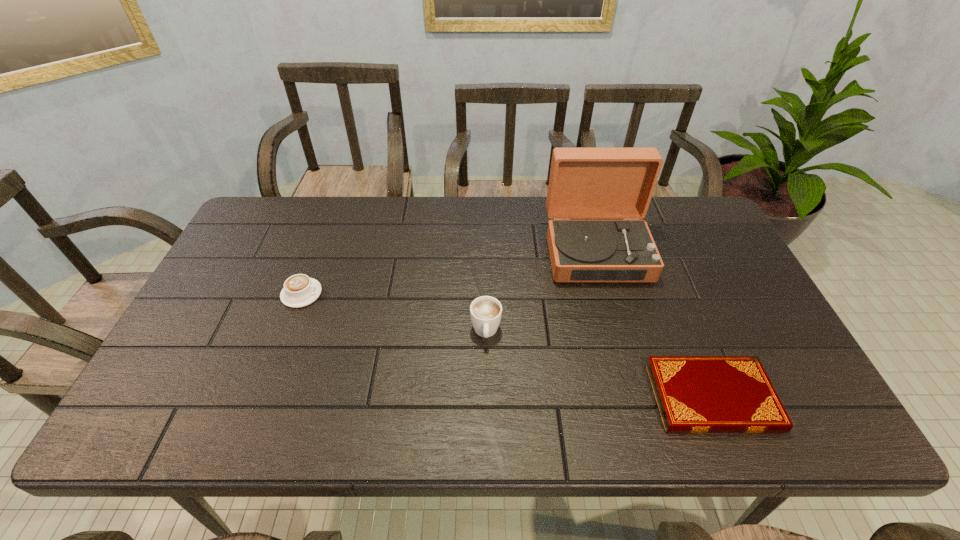
Where is `free location located 0.240m on the cover of the nearest object`? The width and height of the screenshot is (960, 540). free location located 0.240m on the cover of the nearest object is located at coordinates (549, 397).

Locate an element on the screen. This screenshot has width=960, height=540. free point located on the cover of the nearest object is located at coordinates (532, 397).

Where is `vacant space situated on the cover of the nearest object`? This screenshot has height=540, width=960. vacant space situated on the cover of the nearest object is located at coordinates (549, 397).

Where is `object that is at the far edge`? The width and height of the screenshot is (960, 540). object that is at the far edge is located at coordinates (585, 183).

At what (x,y) coordinates should I click in order to perform the action: click on object positioned at the near edge. Please return your answer as a coordinate pair (x, y). Looking at the image, I should click on (695, 394).

You are a GUI agent. You are given a task and a screenshot of the screen. Output one action in this format:
    pyautogui.click(x=<x>, y=<y>)
    Task: Click on the object that is positioned at the right edge
    The height and width of the screenshot is (540, 960).
    Given the screenshot: What is the action you would take?
    pyautogui.click(x=695, y=394)

Locate an element on the screen. The height and width of the screenshot is (540, 960). object located at the near right corner is located at coordinates (695, 394).

The width and height of the screenshot is (960, 540). In order to click on vacant space at the far edge of the desktop in this screenshot , I will do `click(447, 220)`.

This screenshot has height=540, width=960. Identify the location of free space at the near edge of the desktop. (354, 418).

Find the location of a particular element. The image size is (960, 540). vacant space at the right edge of the desktop is located at coordinates coord(741,276).